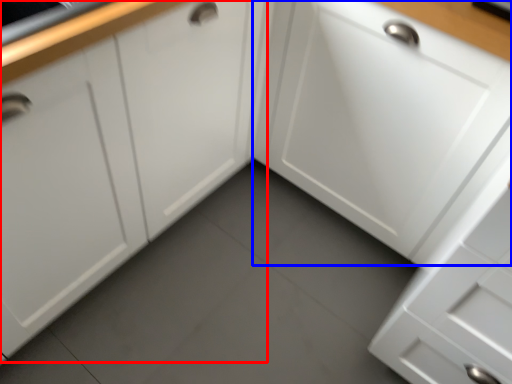
Question: Which object appears farthest to the camera in this image, cabinetry (highlighted by a red box) or cabinetry (highlighted by a blue box)?

Choices:
 (A) cabinetry
 (B) cabinetry

Answer: (B)